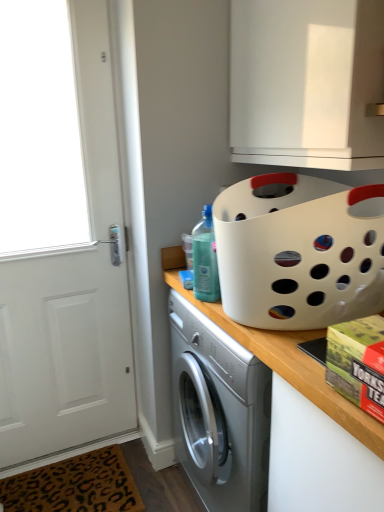
Question: Is green matte box at lower right wider or thinner than white matte cabinet at upper center?

Choices:
 (A) thin
 (B) wide

Answer: (A)

Question: Considering the positions of point (359, 390) and point (304, 8), is point (359, 390) closer or farther from the camera than point (304, 8)?

Choices:
 (A) closer
 (B) farther

Answer: (A)

Question: Estimate the real-world distances between objects in this image. Which object is farther from the white plastic basket at upper right?

Choices:
 (A) white matte countertop at center
 (B) green matte box at lower right
 (C) white matte cabinet at upper center
 (D) white matte door at left
 (E) brown leopard print mat at lower left

Answer: (E)

Question: Which object is the closest to the translucent plastic bottle at upper center?

Choices:
 (A) white matte cabinet at upper center
 (B) white matte door at left
 (C) green matte box at lower right
 (D) brown leopard print mat at lower left
 (E) white matte countertop at center

Answer: (E)